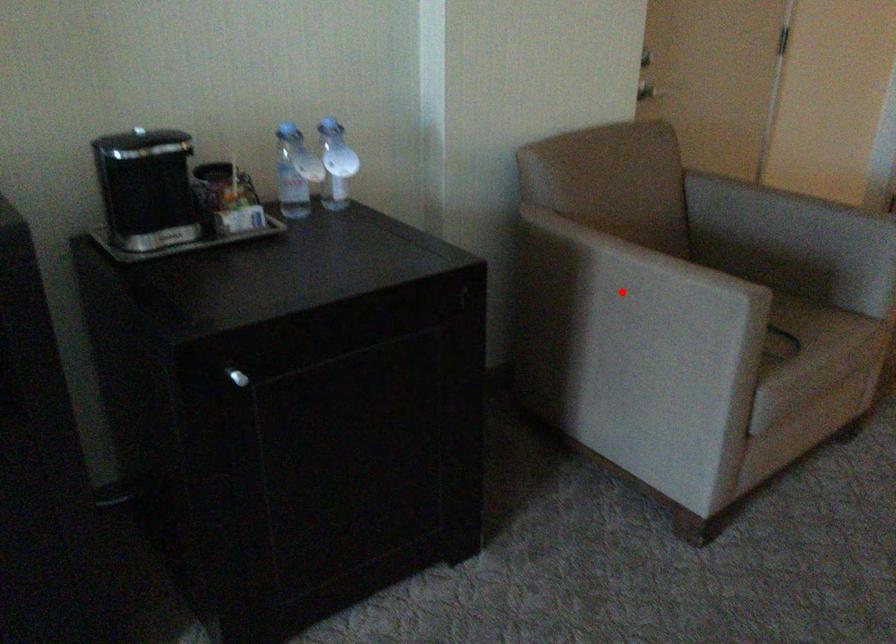
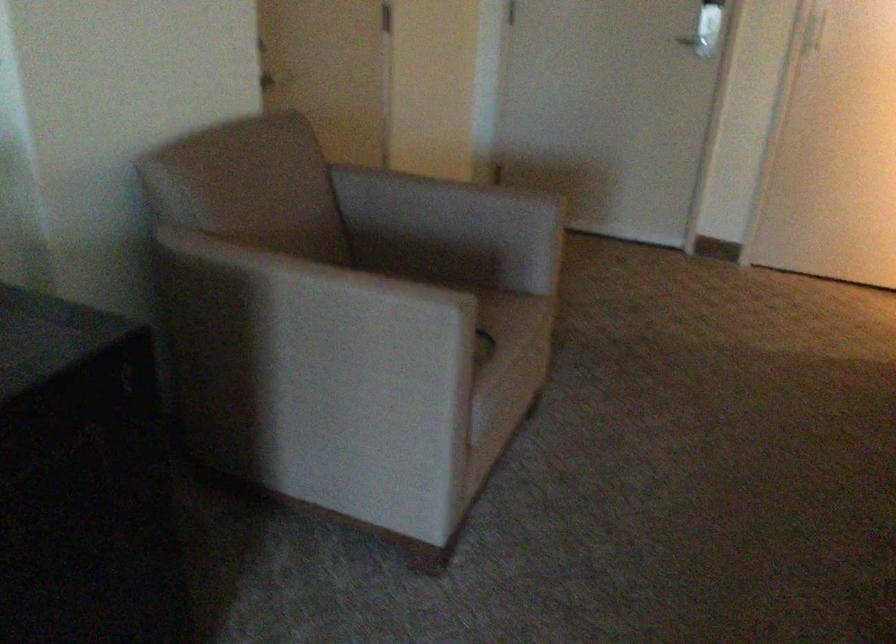
Find the pixel in the second image that matches the highlighted location in the first image.

(314, 325)